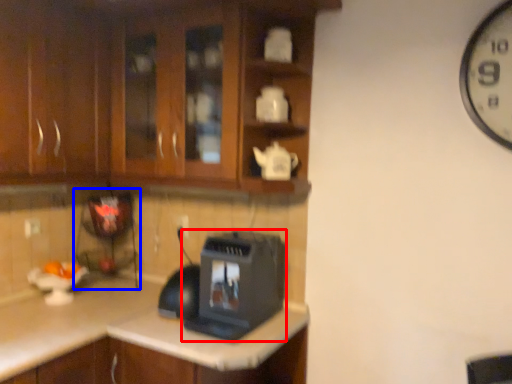
Question: Which of the following is the closest to the observer, home appliance (highlighted by a red box) or appliance (highlighted by a blue box)?

Choices:
 (A) home appliance
 (B) appliance

Answer: (A)